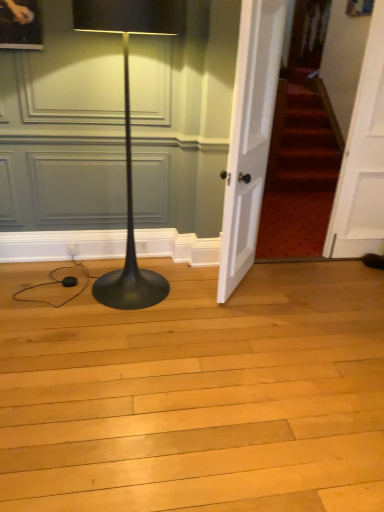
This screenshot has width=384, height=512. What are the coordinates of `free location in front of white wooden door at center, the second door when ordered from right to left` in the screenshot? It's located at pos(239,319).